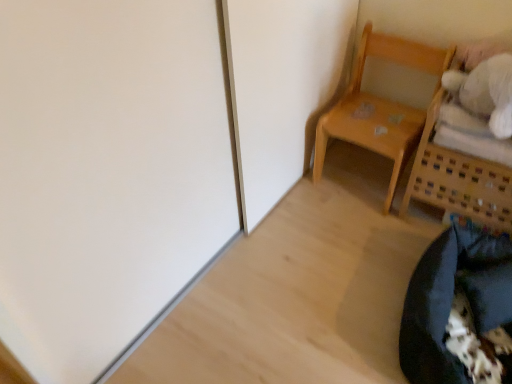
I want to click on free space behind black fabric bean bag chair at lower right, so click(x=372, y=238).